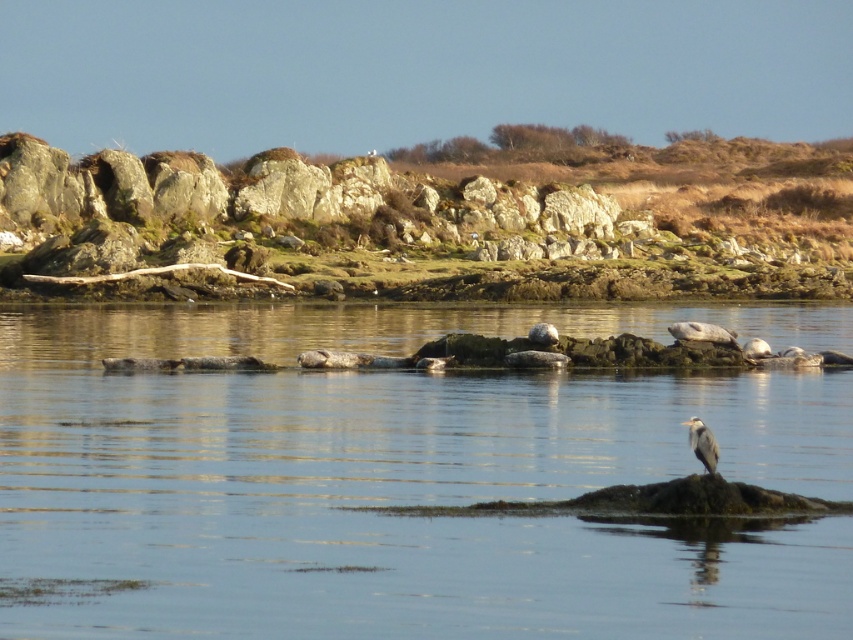
You are a photographer trying to capture the gray matte bird at center and the clear water at center in the same frame. Based on their positions, which object should you adjust your camera focus to first if you want to ensure both are in focus?

The clear water at center is positioned on the left side of gray matte bird at center. To ensure both are in focus, you should focus on the gray matte bird at center first since it is closer to the camera than the clear water at center.

You are a photographer standing at the edge of the water. You want to capture a photo of the gray matte bird at center without the clear water at center being too dominant in the frame. Which object should you focus on to ensure the bird is the main subject?

To ensure the gray matte bird at center is the main subject, focus on the bird while adjusting the composition so the clear water at center does not occupy too much of the frame.

You are a photographer standing on the shore and want to take a photo of the gray matte bird at center and the clear water at center. Which object will appear larger in the photo?

The clear water at center will appear larger in the photo because it is closer to the viewer than the gray matte bird at center.